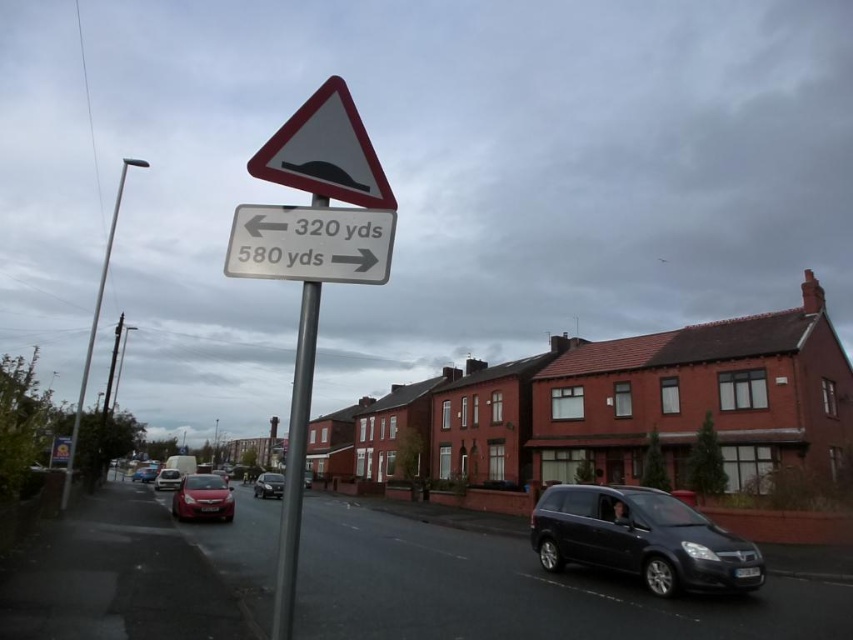
Describe the element at coordinates (641, 538) in the screenshot. The width and height of the screenshot is (853, 640). I see `matte black van at center` at that location.

Is matte black van at center positioned behind metallic pole at center?

Yes, it is.

The image size is (853, 640). Find the location of `matte black van at center`. matte black van at center is located at coordinates (641, 538).

Can you confirm if white plastic sign at center is wider than matte red car at center?

In fact, white plastic sign at center might be narrower than matte red car at center.

Is white plastic sign at center closer to the viewer compared to matte red car at center?

Yes, white plastic sign at center is in front of matte red car at center.

Identify the location of white plastic sign at center. The width and height of the screenshot is (853, 640). (310, 243).

Is white plastic sign at center taller than shiny red car at center?

No, white plastic sign at center is not taller than shiny red car at center.

Who is positioned more to the left, white plastic sign at center or shiny red car at center?

shiny red car at center

Which is behind, point (390, 243) or point (181, 504)?

Point (181, 504)

The image size is (853, 640). In order to click on white plastic sign at center in this screenshot , I will do `click(310, 243)`.